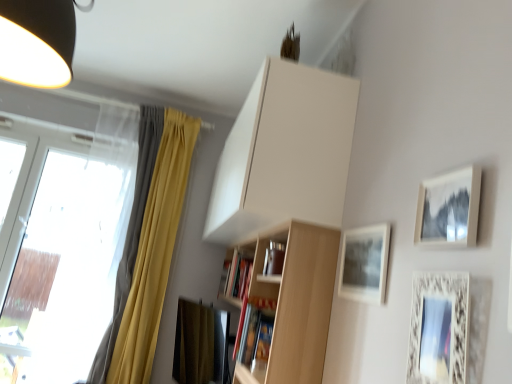
Question: Does white matte cabinet at upper center lie in front of matte white picture frame at upper right, which is the 2th picture frame in front-to-back order?

Choices:
 (A) yes
 (B) no

Answer: (B)

Question: From the image's perspective, would you say white matte cabinet at upper center is shown under matte white picture frame at upper right, which is the 2th picture frame in front-to-back order?

Choices:
 (A) yes
 (B) no

Answer: (B)

Question: Is matte white picture frame at upper right, which is the 2th picture frame in front-to-back order, at the back of white matte cabinet at upper center?

Choices:
 (A) yes
 (B) no

Answer: (B)

Question: Does white matte cabinet at upper center have a lesser height compared to matte white picture frame at upper right, which is the 2th picture frame in front-to-back order?

Choices:
 (A) yes
 (B) no

Answer: (B)

Question: Is white matte cabinet at upper center not inside matte white picture frame at upper right, the 2th picture frame when ordered from back to front?

Choices:
 (A) yes
 (B) no

Answer: (A)

Question: Is yellow fabric curtain at left wider or thinner than white matte cabinet at upper center?

Choices:
 (A) thin
 (B) wide

Answer: (A)

Question: Is point (124, 249) positioned closer to the camera than point (271, 173)?

Choices:
 (A) closer
 (B) farther

Answer: (B)

Question: From a real-world perspective, relative to white matte cabinet at upper center, is yellow fabric curtain at left vertically above or below?

Choices:
 (A) above
 (B) below

Answer: (B)

Question: Is yellow fabric curtain at left spatially inside white matte cabinet at upper center, or outside of it?

Choices:
 (A) outside
 (B) inside

Answer: (A)

Question: Considering the positions of matte gray picture frame at upper right, which is counted as the first picture frame, starting from the back, and white ornate picture frame at lower right, which appears as the first picture frame when viewed from the front, in the image, is matte gray picture frame at upper right, which is counted as the first picture frame, starting from the back, wider or thinner than white ornate picture frame at lower right, which appears as the first picture frame when viewed from the front,?

Choices:
 (A) wide
 (B) thin

Answer: (B)

Question: From a real-world perspective, is matte gray picture frame at upper right, the 3th picture frame in the front-to-back sequence, above or below white ornate picture frame at lower right, which appears as the first picture frame when viewed from the front?

Choices:
 (A) above
 (B) below

Answer: (A)

Question: Is matte gray picture frame at upper right, the 3th picture frame in the front-to-back sequence, spatially inside white ornate picture frame at lower right, which is the third picture frame from back to front, or outside of it?

Choices:
 (A) inside
 (B) outside

Answer: (B)

Question: Based on their positions, is matte gray picture frame at upper right, the 3th picture frame in the front-to-back sequence, located to the left or right of white ornate picture frame at lower right, which appears as the first picture frame when viewed from the front?

Choices:
 (A) left
 (B) right

Answer: (A)

Question: Visually, is white ornate picture frame at lower right, which appears as the first picture frame when viewed from the front, positioned to the left or to the right of yellow fabric curtain at left?

Choices:
 (A) right
 (B) left

Answer: (A)

Question: From a real-world perspective, is white ornate picture frame at lower right, which appears as the first picture frame when viewed from the front, positioned above or below yellow fabric curtain at left?

Choices:
 (A) above
 (B) below

Answer: (B)